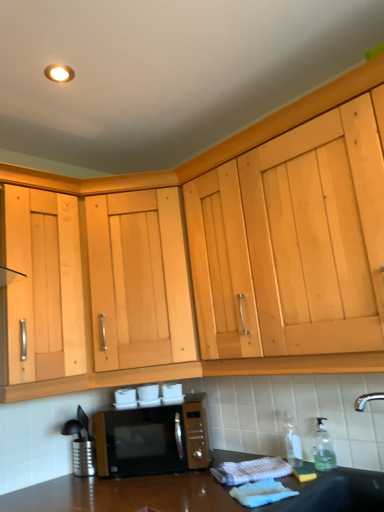
Question: Can matte black microwave at lower center be found inside black matte sink at lower right?

Choices:
 (A) yes
 (B) no

Answer: (B)

Question: From a real-world perspective, is black matte sink at lower right below matte black microwave at lower center?

Choices:
 (A) no
 (B) yes

Answer: (B)

Question: Does black matte sink at lower right lie in front of matte black microwave at lower center?

Choices:
 (A) yes
 (B) no

Answer: (A)

Question: Is black matte sink at lower right to the right of matte black microwave at lower center from the viewer's perspective?

Choices:
 (A) yes
 (B) no

Answer: (A)

Question: Considering the relative sizes of black matte sink at lower right and matte black microwave at lower center in the image provided, is black matte sink at lower right smaller than matte black microwave at lower center?

Choices:
 (A) yes
 (B) no

Answer: (B)

Question: Is black matte sink at lower right positioned beyond the bounds of matte black microwave at lower center?

Choices:
 (A) no
 (B) yes

Answer: (B)

Question: Is light wood cabinet at center aimed at black matte sink at lower right?

Choices:
 (A) no
 (B) yes

Answer: (A)

Question: Is light wood cabinet at center positioned behind black matte sink at lower right?

Choices:
 (A) no
 (B) yes

Answer: (B)

Question: Is light wood cabinet at center facing away from black matte sink at lower right?

Choices:
 (A) no
 (B) yes

Answer: (A)

Question: Does light wood cabinet at center have a greater width compared to black matte sink at lower right?

Choices:
 (A) no
 (B) yes

Answer: (A)

Question: Does light wood cabinet at center have a greater height compared to black matte sink at lower right?

Choices:
 (A) yes
 (B) no

Answer: (A)

Question: From a real-world perspective, does light wood cabinet at center stand above black matte sink at lower right?

Choices:
 (A) no
 (B) yes

Answer: (B)

Question: Could black matte sink at lower right be considered to be inside clear glass bottle at lower right, the 1th bottle positioned from the left?

Choices:
 (A) no
 (B) yes

Answer: (A)